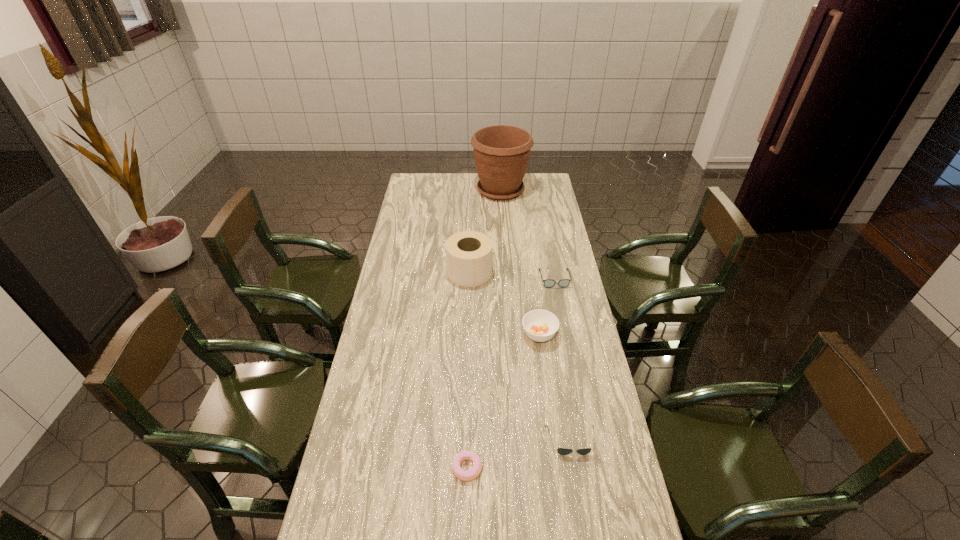
Identify the location of vacant area that lies between the spectacles and the sunglasses. (563, 360).

Where is `vacant space in between the doughnut and the soup bowl`? Image resolution: width=960 pixels, height=540 pixels. vacant space in between the doughnut and the soup bowl is located at coordinates (503, 401).

The height and width of the screenshot is (540, 960). Identify the location of free point between the second tallest object and the soup bowl. (504, 303).

Locate an element on the screen. object that is the fourth closest one to the sunglasses is located at coordinates (469, 254).

Point out which object is positioned as the fifth nearest to the fifth shortest object. Please provide its 2D coordinates. Your answer should be formatted as a tuple, i.e. [(x, y)], where the tuple contains the x and y coordinates of a point satisfying the conditions above.

[(472, 474)]

In order to click on vacant region that satisfies the following two spatial constraints: 1. on the front side of the toilet tissue; 2. on the left side of the fourth shortest object in this screenshot , I will do `click(468, 335)`.